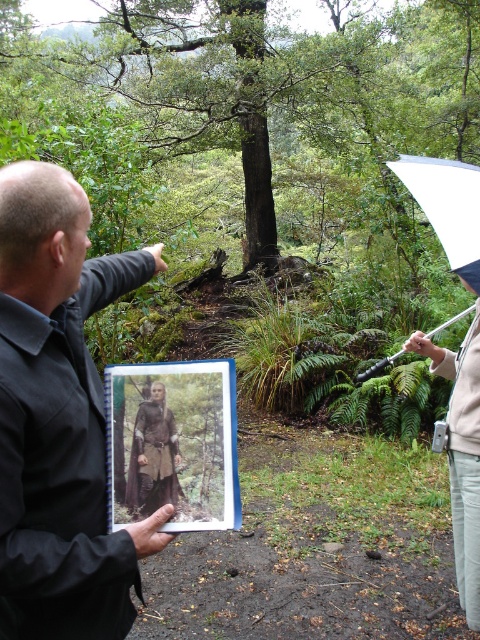
Is light beige pants at right bigger than white matte umbrella at upper right?

Yes, light beige pants at right is bigger than white matte umbrella at upper right.

Locate an element on the screen. light beige pants at right is located at coordinates (462, 444).

Can you confirm if dark brown leather jacket at upper left is shorter than white matte umbrella at upper right?

Incorrect, dark brown leather jacket at upper left's height does not fall short of white matte umbrella at upper right's.

Is point (83, 387) positioned in front of point (458, 173)?

Yes, point (83, 387) is in front of point (458, 173).

Who is more distant from viewer, [37,490] or [453,221]?

The point [453,221] is more distant.

You are a GUI agent. You are given a task and a screenshot of the screen. Output one action in this format:
    pyautogui.click(x=<x>, y=<y>)
    Task: Click on the dark brown leather jacket at upper left
    
    Given the screenshot: What is the action you would take?
    pyautogui.click(x=60, y=417)

Is dark brown leather jacket at upper left positioned at the back of light beige pants at right?

No, dark brown leather jacket at upper left is in front of light beige pants at right.

Is dark brown leather jacket at upper left to the left of light beige pants at right from the viewer's perspective?

Indeed, dark brown leather jacket at upper left is positioned on the left side of light beige pants at right.

Which is in front, point (123, 253) or point (450, 413)?

Point (123, 253) is more forward.

Find the location of `dark brown leather jacket at upper left`. dark brown leather jacket at upper left is located at coordinates (60, 417).